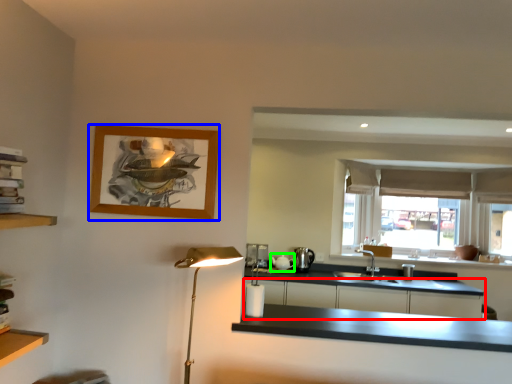
Question: Considering the real-world distances, which object is farthest from cabinetry (highlighted by a red box)? picture frame (highlighted by a blue box) or appliance (highlighted by a green box)?

Choices:
 (A) picture frame
 (B) appliance

Answer: (A)